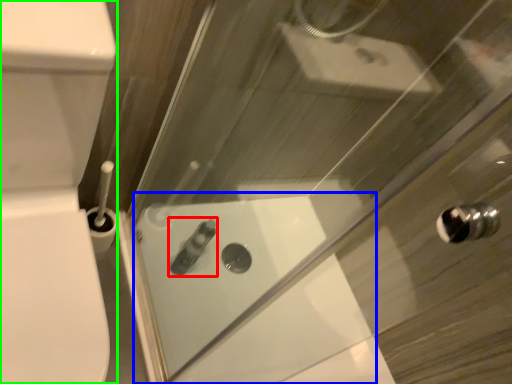
Question: Which is nearer to the toiletry (highlighted by a red box)? bath (highlighted by a blue box) or porcelain (highlighted by a green box).

Choices:
 (A) bath
 (B) porcelain

Answer: (A)